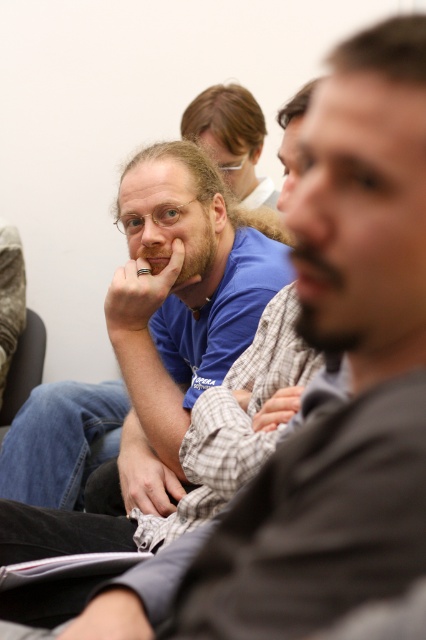
Question: Which object appears farthest from the camera in this image?

Choices:
 (A) matte skin at center
 (B) dark gray fabric armchair at lower left
 (C) matte blue shirt at center

Answer: (B)

Question: Can you confirm if matte blue shirt at center is wider than matte skin at center?

Choices:
 (A) no
 (B) yes

Answer: (B)

Question: Is the position of matte blue shirt at center more distant than that of matte skin at center?

Choices:
 (A) no
 (B) yes

Answer: (B)

Question: Is matte blue shirt at center to the left of smooth skin mouth at center from the viewer's perspective?

Choices:
 (A) no
 (B) yes

Answer: (B)

Question: Which point appears closest to the camera in this image?

Choices:
 (A) (253, 200)
 (B) (23, 381)
 (C) (155, 260)
 (D) (344, 282)

Answer: (D)

Question: Based on their relative distances, which object is nearer to the matte blue shirt at center?

Choices:
 (A) matte skin at center
 (B) dark gray fabric armchair at lower left
 (C) smooth skin mouth at center

Answer: (A)